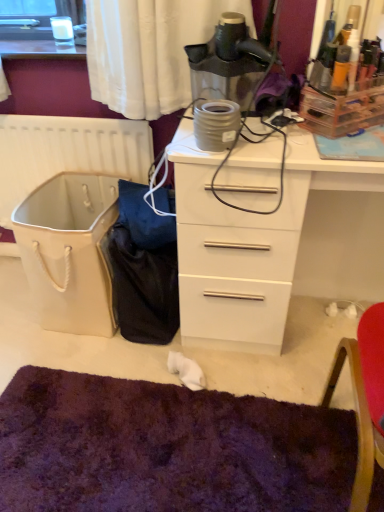
Identify the location of vacant area that lies in front of matte black hairdryer at upper center. Image resolution: width=384 pixels, height=512 pixels. (249, 145).